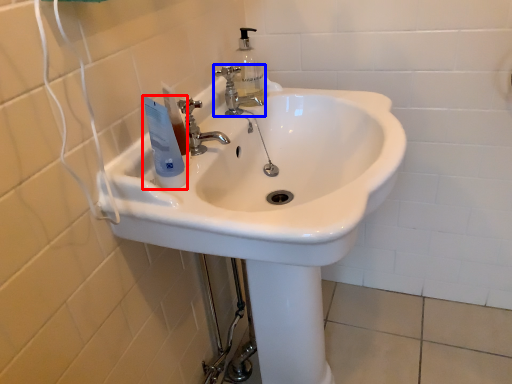
Question: Which point is closer to the camera, mouthwash (highlighted by a red box) or tap (highlighted by a blue box)?

Choices:
 (A) mouthwash
 (B) tap

Answer: (A)